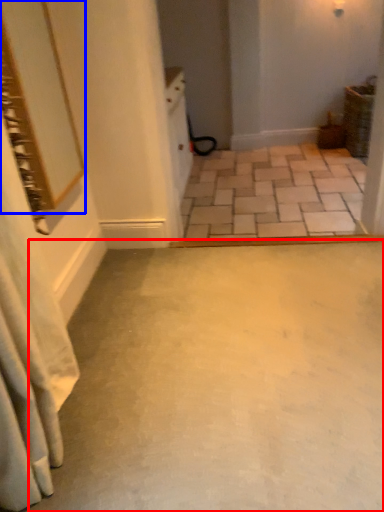
Question: Among these objects, which one is nearest to the camera, concrete (highlighted by a red box) or mirror (highlighted by a blue box)?

Choices:
 (A) concrete
 (B) mirror

Answer: (A)